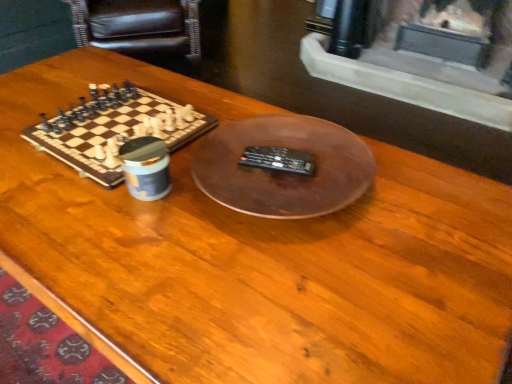
Image resolution: width=512 pixels, height=384 pixels. What are the coordinates of `free space in front of wooden chessboard at left` in the screenshot? It's located at (87, 228).